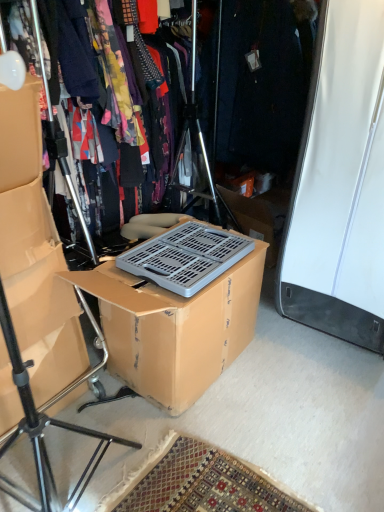
Question: From a real-world perspective, is matte black tripod at left physically located above or below floral fabric dress at center?

Choices:
 (A) above
 (B) below

Answer: (B)

Question: Considering the positions of matte black tripod at left and floral fabric dress at center in the image, is matte black tripod at left wider or thinner than floral fabric dress at center?

Choices:
 (A) wide
 (B) thin

Answer: (A)

Question: Estimate the real-world distances between objects in this image. Which object is closer to the matte black tripod at left?

Choices:
 (A) floral fabric dress at center
 (B) matte cardboard box at left
 (C) brown cardboard box at center

Answer: (B)

Question: Which object is positioned farthest from the matte black tripod at left?

Choices:
 (A) floral fabric dress at center
 (B) matte cardboard box at left
 (C) brown cardboard box at center

Answer: (A)